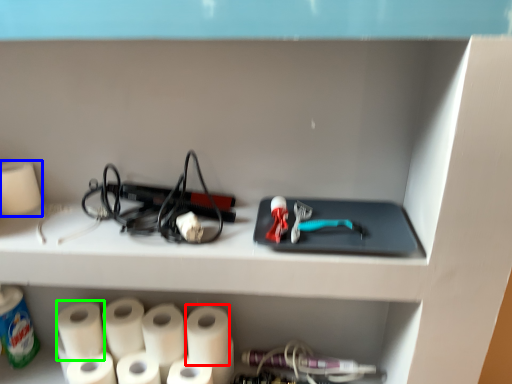
Question: Estimate the real-world distances between objects in this image. Which object is closer to paper towel (highlighted by a red box), paper towel (highlighted by a blue box) or paper towel (highlighted by a green box)?

Choices:
 (A) paper towel
 (B) paper towel

Answer: (B)